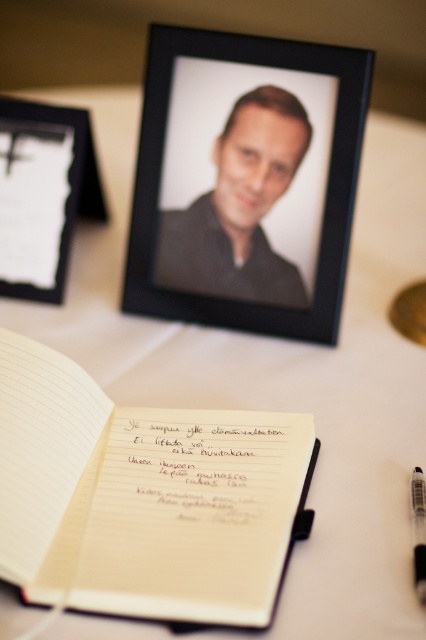
You are organizing a desk and need to place a 30 cm wide decorative item between the white paper notebook at center and the black matte picture frame at upper center. Is there enough space?

The distance between the white paper notebook at center and the black matte picture frame at upper center is 32.90 centimeters. Since the decorative item is 30 cm wide, there is enough space to place it between them as 30 cm is less than 32.90 cm.

What is located at the coordinates point (x=239, y=208)?

The point (x=239, y=208) indicates a matte black portrait at center.